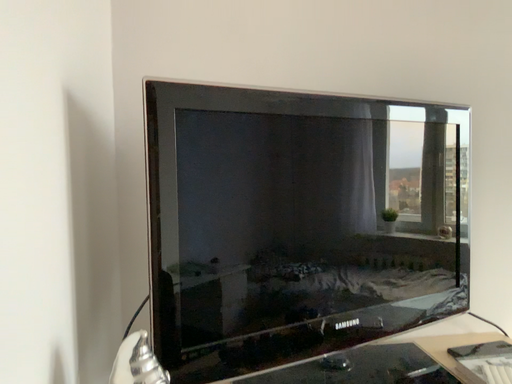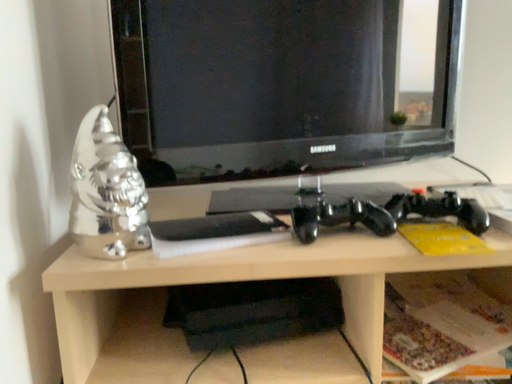
Question: Which way did the camera rotate in the video?

Choices:
 (A) rotated downward
 (B) rotated upward

Answer: (A)